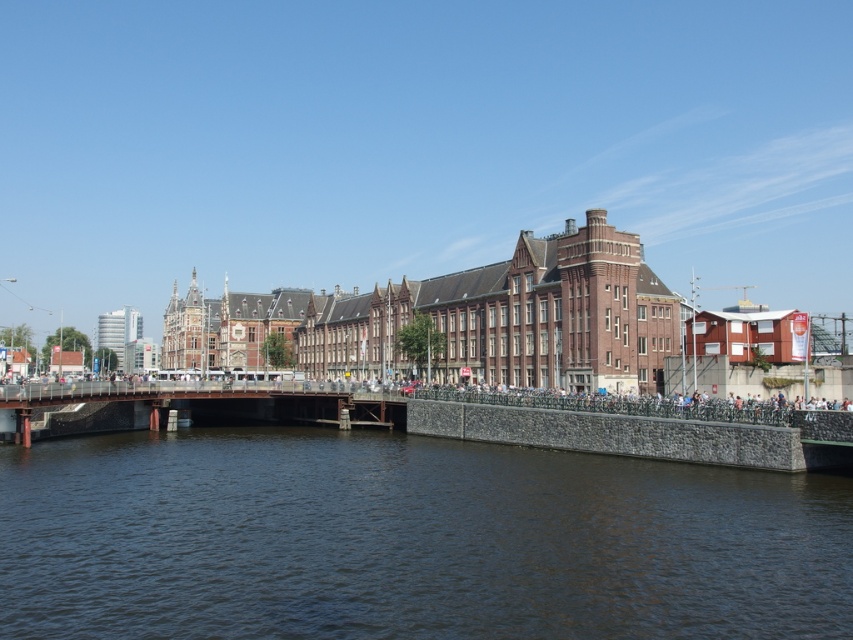
You are a delivery drone that needs to fly over the dark brown water at center to deliver a package to the brown metal bridge at center. Given that your drone has a maximum flight range of 80 feet, will you be able to make the trip without recharging?

The distance between the dark brown water at center and the brown metal bridge at center is 77.74 feet, which is within the drone s 80 feet maximum flight range. Therefore, the drone can complete the trip without needing to recharge.

You are standing on the stone embankment and see the dark brown water at center and the brown metal bridge at center. Which object is nearer to you?

The dark brown water at center is closer to the viewer than the brown metal bridge at center, so the dark brown water at center is nearer to you.

You are standing on the stone embankment and want to cross the river to the buildings on the far side. Can you walk directly across the dark brown water at center to reach the brown metal bridge at center?

The dark brown water at center is located below the brown metal bridge at center, so you cannot walk directly across the water to reach the bridge since the bridge is above the water.